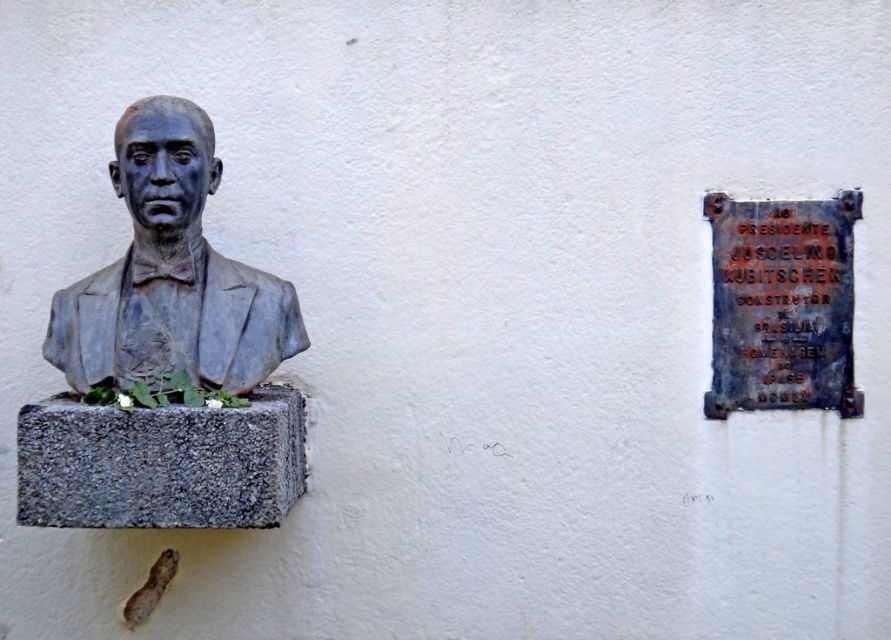
You are an art conservator examining the wall where the matte bronze bust at left and the plaque are mounted. You notice a small crack at point (x=170, y=273). Which object is this crack affecting?

The crack at point (x=170, y=273) is affecting the matte bronze bust at left, as this coordinate corresponds to its location.